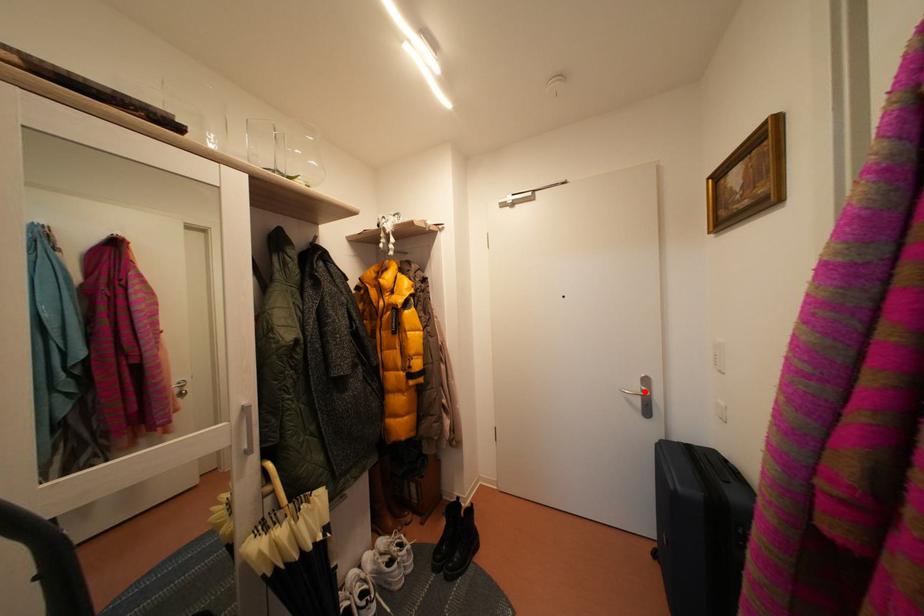
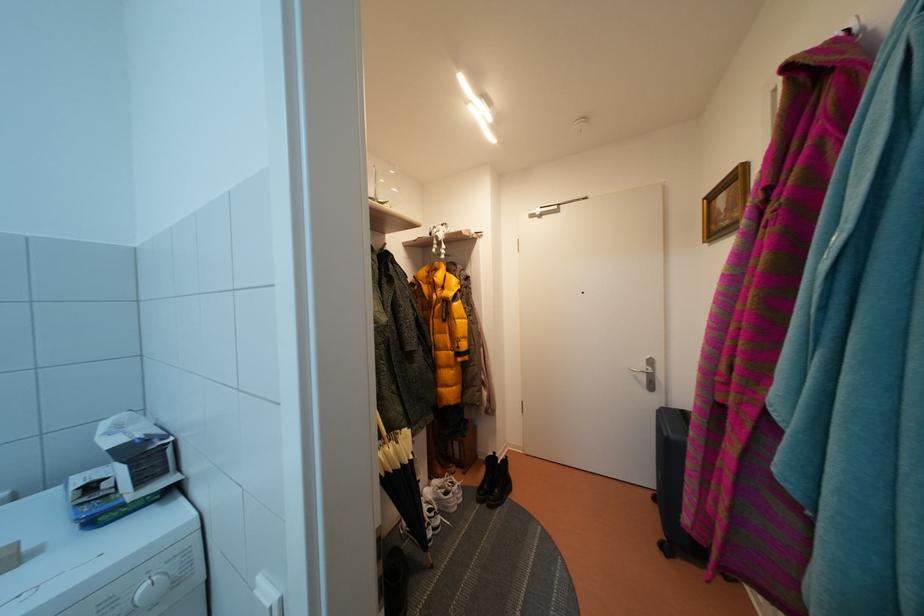
In the second image, find the point that corresponds to the highlighted location in the first image.

(650, 371)